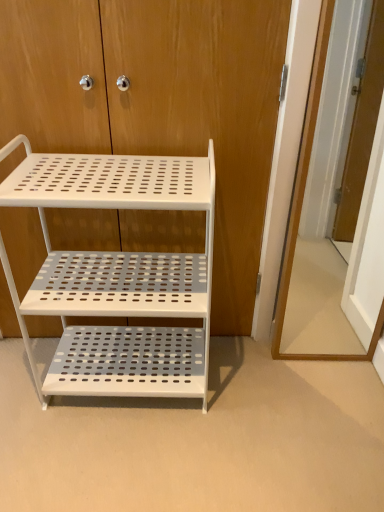
Question: Considering the positions of white perforated metal shelf at center and wooden door at right in the image, is white perforated metal shelf at center wider or thinner than wooden door at right?

Choices:
 (A) thin
 (B) wide

Answer: (B)

Question: From a real-world perspective, is white perforated metal shelf at center above or below wooden door at right?

Choices:
 (A) below
 (B) above

Answer: (A)

Question: Estimate the real-world distances between objects in this image. Which object is closer to the white perforated metal shelf at center?

Choices:
 (A) wooden door at right
 (B) white perforated metal shelf at center

Answer: (B)

Question: Based on their relative distances, which object is farther from the white perforated metal shelf at center?

Choices:
 (A) white perforated metal shelf at center
 (B) wooden door at right

Answer: (B)